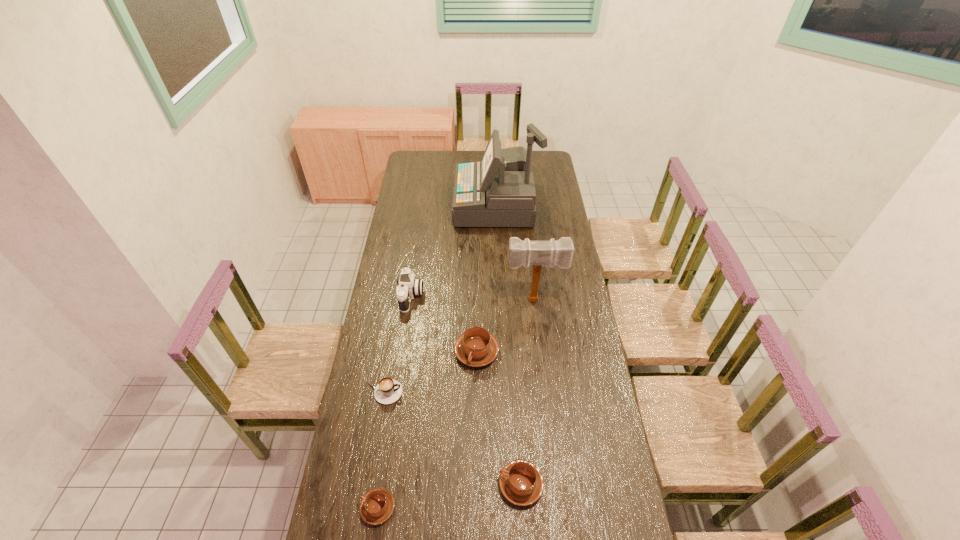
Where is `free space located on the side of the third shortest object with the handle`? free space located on the side of the third shortest object with the handle is located at coordinates (388, 484).

This screenshot has width=960, height=540. Find the location of `vacant space located 0.330m on the side of the third shortest object with the handle`. vacant space located 0.330m on the side of the third shortest object with the handle is located at coordinates coord(397,484).

Locate an element on the screen. The image size is (960, 540). vacant space situated 0.160m with the handle on the side of the third nearest cappuccino is located at coordinates (444, 392).

The image size is (960, 540). Identify the location of blank space located 0.050m on the side of the leftmost brown cappuccino with the handle. (345, 508).

Locate an element on the screen. Image resolution: width=960 pixels, height=540 pixels. vacant region located on the side of the leftmost brown cappuccino with the handle is located at coordinates (342, 508).

This screenshot has height=540, width=960. Find the location of `camera that is at the left edge`. camera that is at the left edge is located at coordinates (408, 286).

You are a GUI agent. You are given a task and a screenshot of the screen. Output one action in this format:
    pyautogui.click(x=<x>, y=<y>)
    Task: Click on the cash register that is at the right edge
    
    Given the screenshot: What is the action you would take?
    pyautogui.click(x=499, y=191)

At what (x,y) coordinates should I click in order to perform the action: click on mallet that is at the right edge. Please return your answer as a coordinate pair (x, y). The height and width of the screenshot is (540, 960). Looking at the image, I should click on (537, 253).

In the image, there is a desktop. Where is `vacant space at the left edge`? vacant space at the left edge is located at coordinates pyautogui.click(x=396, y=256).

You are a GUI agent. You are given a task and a screenshot of the screen. Output one action in this format:
    pyautogui.click(x=<x>, y=<y>)
    Task: Click on the free region at the right edge of the desktop
    
    Given the screenshot: What is the action you would take?
    pyautogui.click(x=548, y=186)